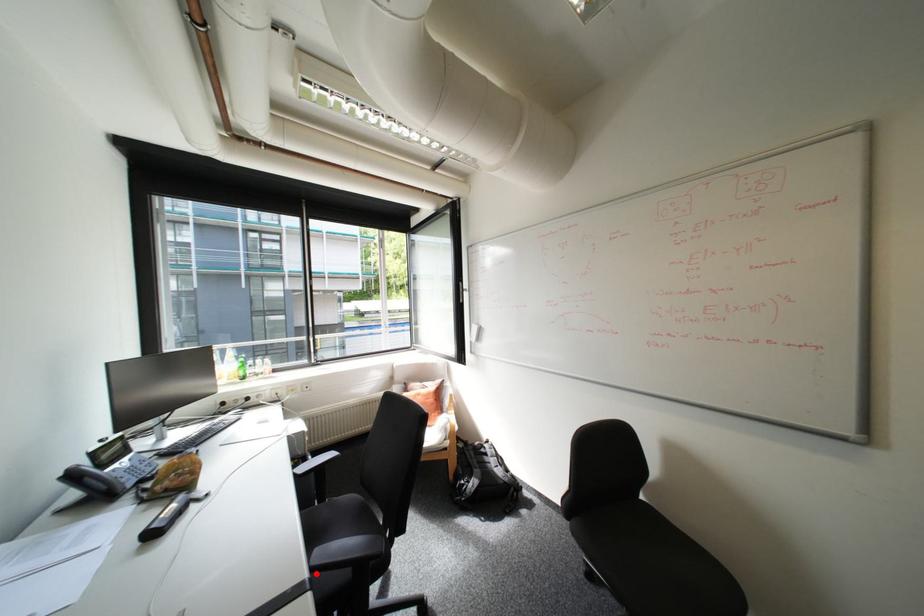
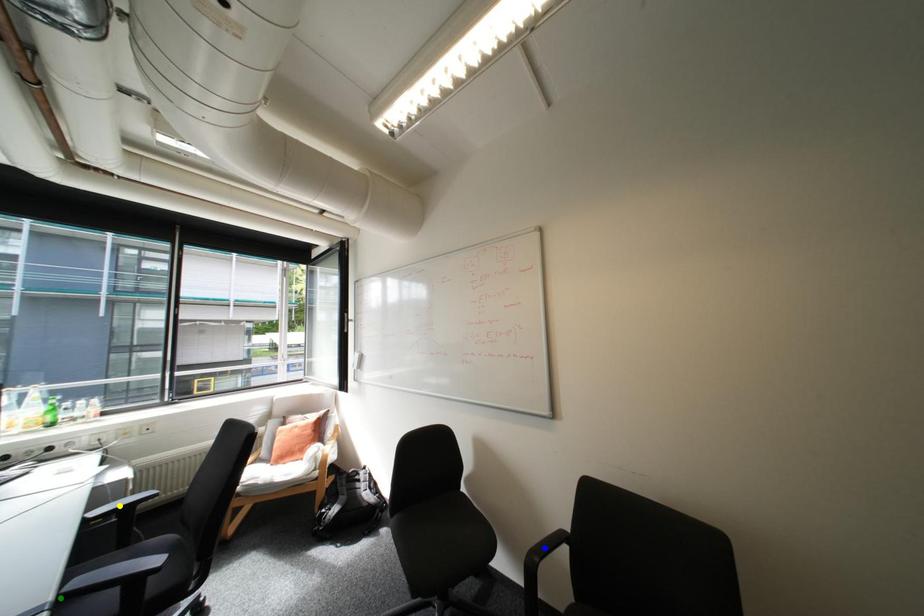
Question: I am providing you with two images of the same scene from different viewpoints. A red point is marked on the first image. You are given multiple points on the second image. In image 2, which mark is for the same physical point as the one in image 1?

Choices:
 (A) blue point
 (B) green point
 (C) yellow point

Answer: (B)